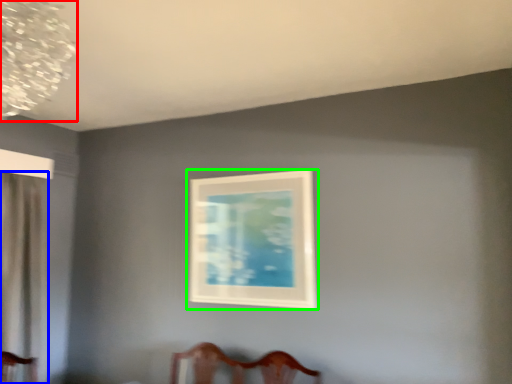
Question: Which object is the farthest from lamp (highlighted by a red box)? Choose among these: curtain (highlighted by a blue box) or picture frame (highlighted by a green box).

Choices:
 (A) curtain
 (B) picture frame

Answer: (B)